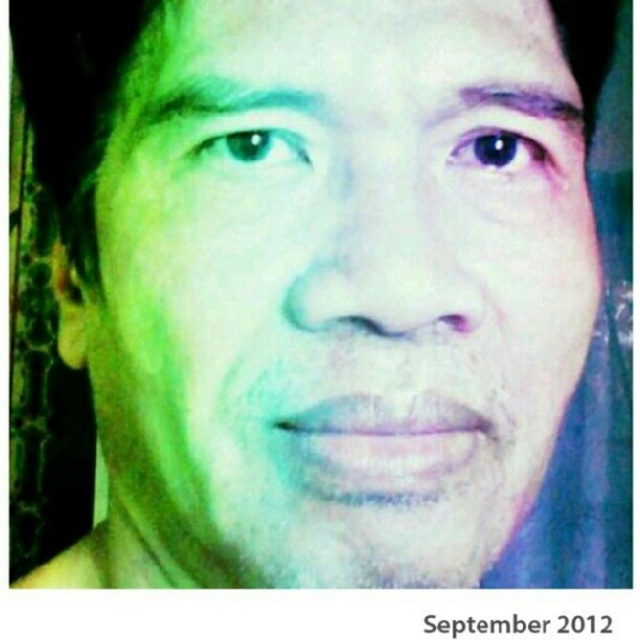
You are a photographer reviewing this image. You notice two points marked on the face at coordinates point (193, 81) and point (518, 148). Based on their positions, which point is closer to the camera?

Point (193, 81) is in front of point (518, 148), so it is closer to the camera.

You are a photographer reviewing a portrait image. You notice two eyes in the photo. The green matte eye at upper left and the blue glossy eye at upper center. Which eye appears smaller in the image?

The green matte eye at upper left appears smaller compared to the blue glossy eye at upper center.